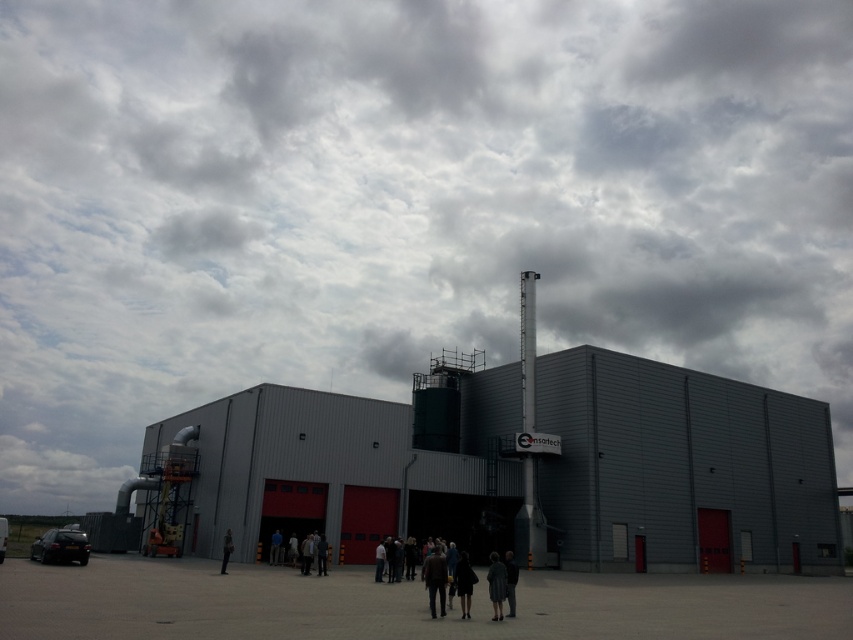
Question: Does dark brown leather jacket at center appear on the left side of dark gray fabric dress at center?

Choices:
 (A) no
 (B) yes

Answer: (B)

Question: Does gray metallic building at center appear under dark gray fabric dress at center?

Choices:
 (A) no
 (B) yes

Answer: (A)

Question: Which object appears farthest from the camera in this image?

Choices:
 (A) dark gray fabric dress at center
 (B) gray metallic building at center
 (C) dark brown leather jacket at center
 (D) dark gray coat at center

Answer: (B)

Question: Among these objects, which one is nearest to the camera?

Choices:
 (A) gray metallic building at center
 (B) dark gray fabric dress at center
 (C) dark gray coat at center
 (D) dark brown leather jacket at center

Answer: (C)

Question: Can you confirm if gray metallic building at center is positioned to the left of dark brown leather jacket at center?

Choices:
 (A) no
 (B) yes

Answer: (A)

Question: Which point is closer to the camera?

Choices:
 (A) (436, 586)
 (B) (610, 353)

Answer: (A)